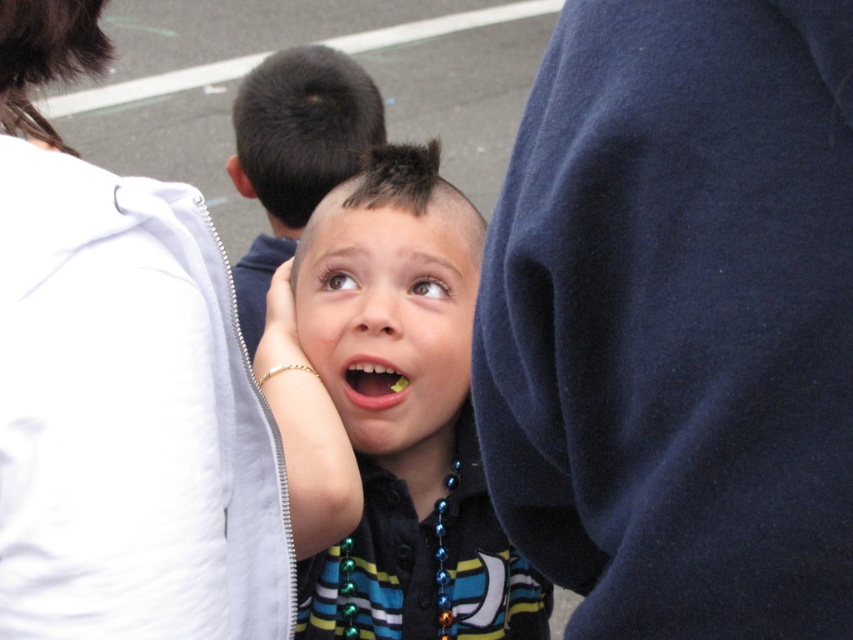
You are a photographer trying to capture the perfect shot of the scene. You notice the white fabric at upper left and the yellow plastic teeth at center. Which object should you focus on first if you want to include both in your frame without cropping either?

The white fabric at upper left is larger in size than the yellow plastic teeth at center, so you should focus on the white fabric at upper left first to ensure it fits properly in the frame before adjusting for the smaller yellow plastic teeth at center.